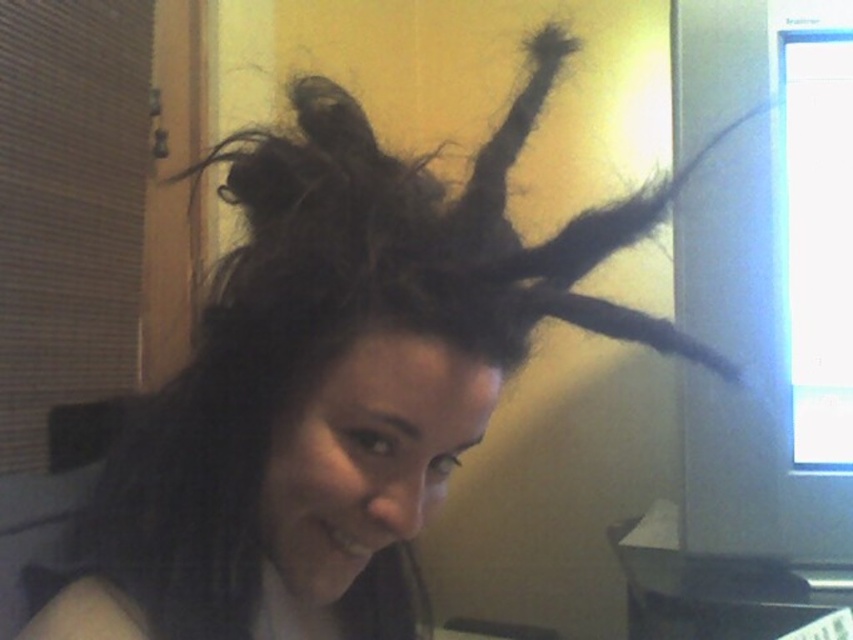
Can you confirm if matte black monitor at right is taller than metallic gray computer desk at lower right?

Yes.

Which is in front, point (691, 536) or point (653, 620)?

Positioned in front is point (691, 536).

Is point (699, 404) farther from camera compared to point (630, 605)?

No, (699, 404) is closer to viewer.

Where is `matte black monitor at right`? The height and width of the screenshot is (640, 853). matte black monitor at right is located at coordinates (746, 362).

Is point (436, 186) more distant than point (750, 595)?

No.

Which is more to the right, dark fuzzy hair at center or metallic gray computer desk at lower right?

metallic gray computer desk at lower right is more to the right.

Is point (341, 225) closer to viewer compared to point (709, 618)?

Yes, point (341, 225) is in front of point (709, 618).

Identify the location of dark fuzzy hair at center. (424, 234).

What do you see at coordinates (424, 234) in the screenshot? I see `dark fuzzy hair at center` at bounding box center [424, 234].

This screenshot has width=853, height=640. What are the coordinates of `dark fuzzy hair at center` in the screenshot? It's located at (424, 234).